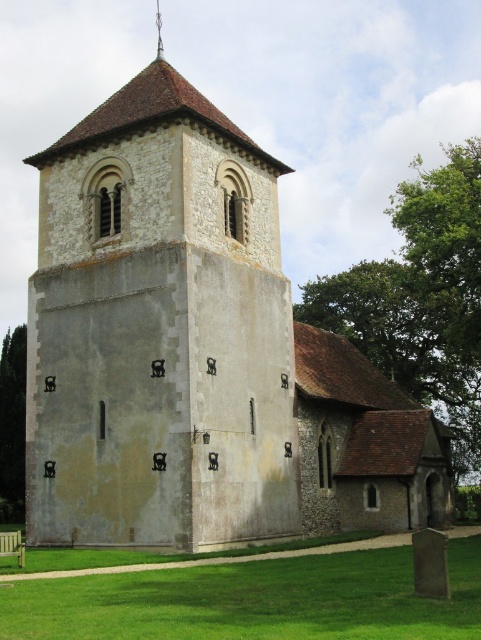
You are standing in front of the historic stone church and want to take a photo that includes both the white stone tower at center and the green grass at lower center. Which object will appear larger in the photo?

The white stone tower at center will appear larger in the photo because it is taller than the green grass at lower center.

You are standing on the green grass at lower center in front of the historic stone church. You want to climb up to the white stone tower at center. Is the tower accessible from where you are standing?

The white stone tower at center is located above green grass at lower center, so yes, the tower is accessible from where you are standing since it is positioned above the grass area.